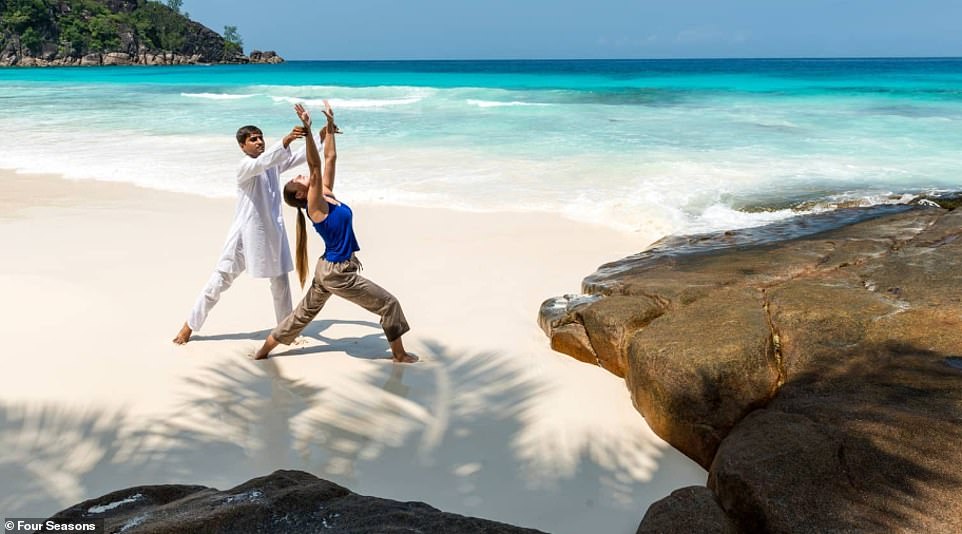
Locate an element on the screen. shade is located at coordinates (393, 411).